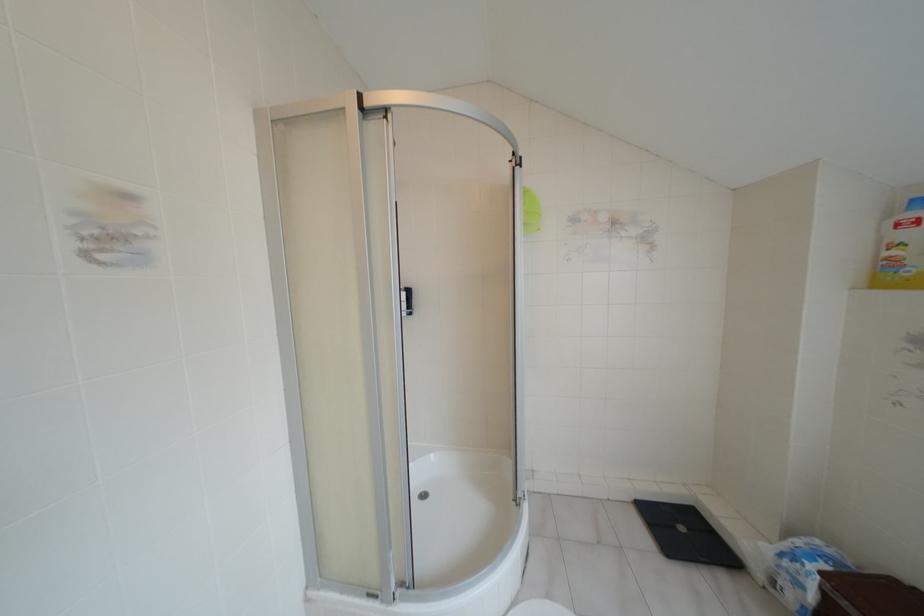
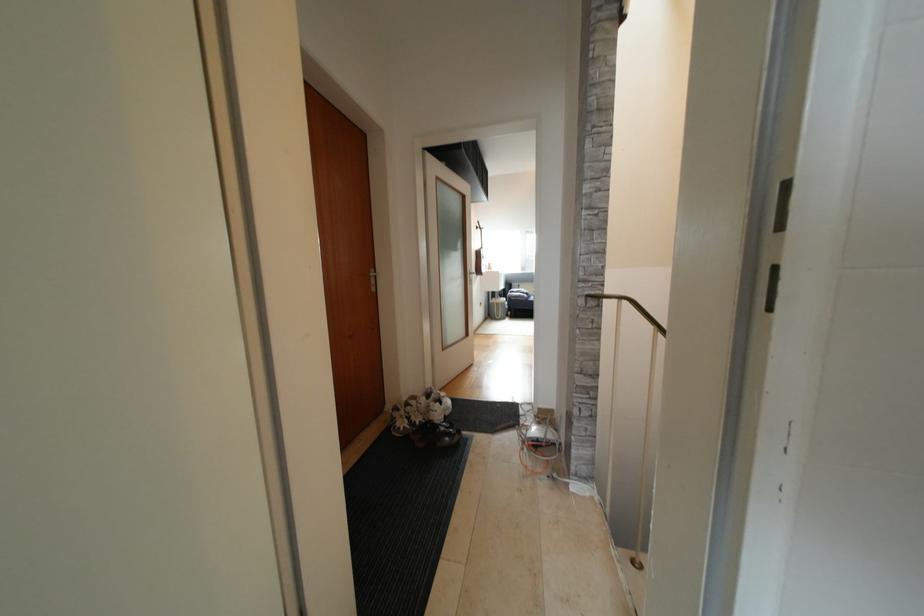
Question: The camera is either moving clockwise (left) or counter-clockwise (right) around the object. The first image is from the beginning of the video and the second image is from the end. Is the camera moving left or right when shooting the video?

Choices:
 (A) Left
 (B) Right

Answer: (B)